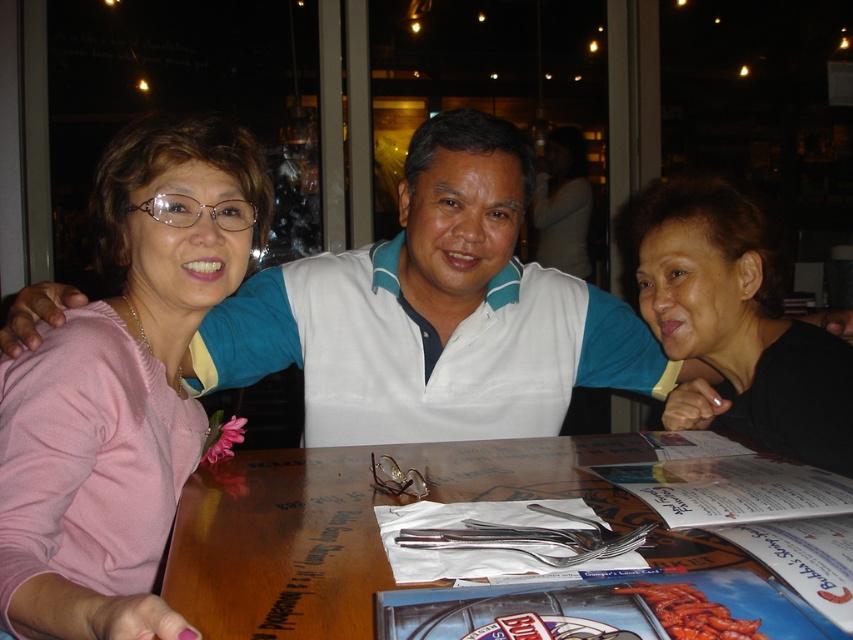
You are a server at the restaurant. You need to place a new plate that is 12 inches in diameter on the wooden table at center. The grilled red lobster at table center is already occupying some space. Can you fit the plate on the table without moving the lobster?

The wooden table at center might be wider than grilled red lobster at table center, so there is a possibility that the plate can fit if the table has enough space around the lobster. However, since the exact dimensions aren t specified, it s uncertain. The server should check the available space carefully before placing the plate.

You are a photographer standing in front of the table. You want to take a closeup photo of the menu and the flower. The menu is located at point [669,544] and the flower is at point [688,589]. Which object should you focus on first to ensure both are in focus?

You should focus on the menu at point [669,544] first because it is closer to the camera than the flower at point [688,589]. This ensures both will be in focus as the flower is further away.

You are a food delivery person who needs to place a hot plate on the wooden table at center without covering the grilled red lobster at table center. Can you do it based on their sizes?

The wooden table at center is larger in size than grilled red lobster at table center, so yes, the hot plate can be placed on the wooden table at center without covering the grilled red lobster at table center since there is enough space.